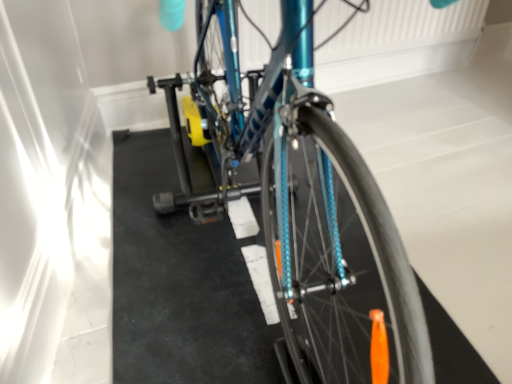
Question: Should I look upward or downward to see teal metallic bicycle at center?

Choices:
 (A) up
 (B) down

Answer: (A)